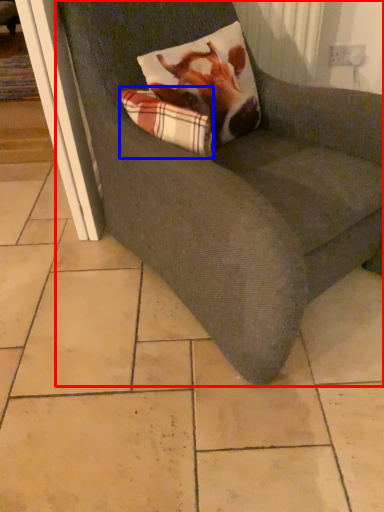
Question: Which of the following is the closest to the observer, chair (highlighted by a red box) or plaid (highlighted by a blue box)?

Choices:
 (A) chair
 (B) plaid

Answer: (A)